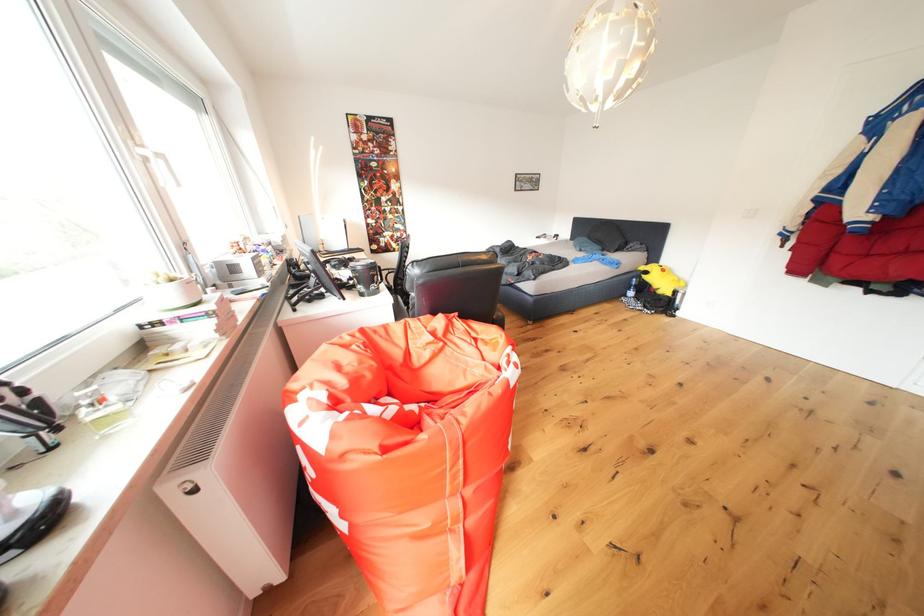
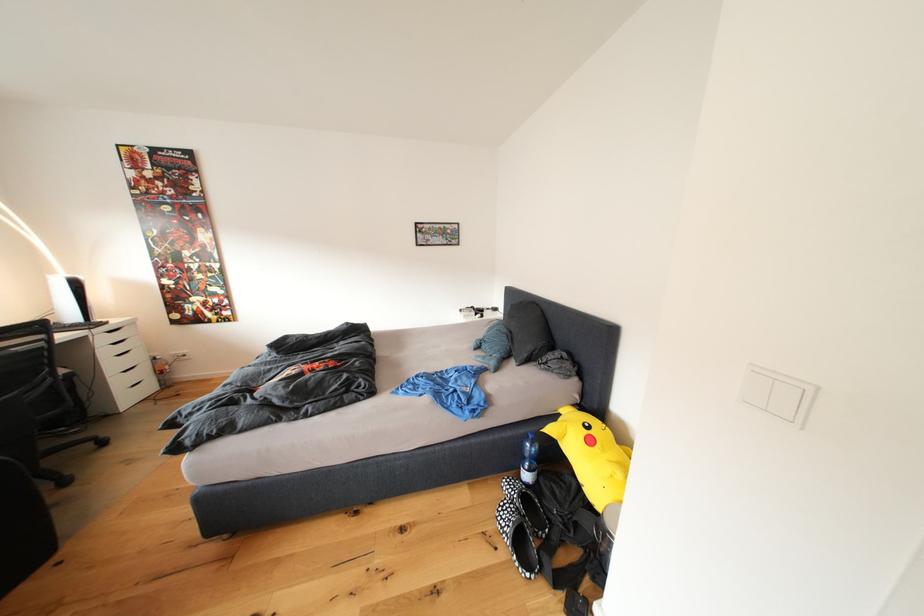
Locate, in the second image, the point that corresponds to [672,275] in the first image.

(600, 446)